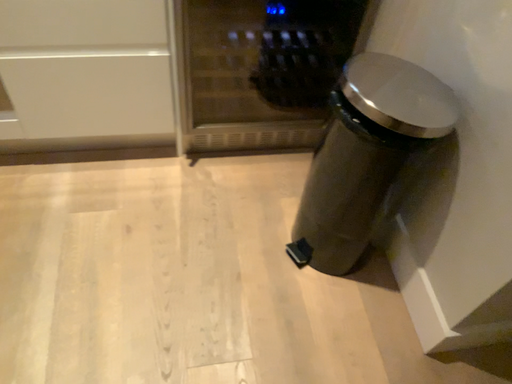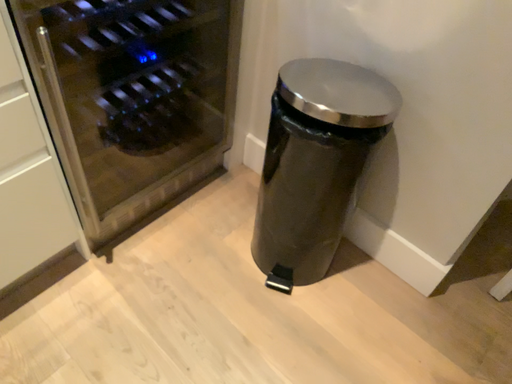
Question: Which way did the camera rotate in the video?

Choices:
 (A) rotated left
 (B) rotated right

Answer: (B)